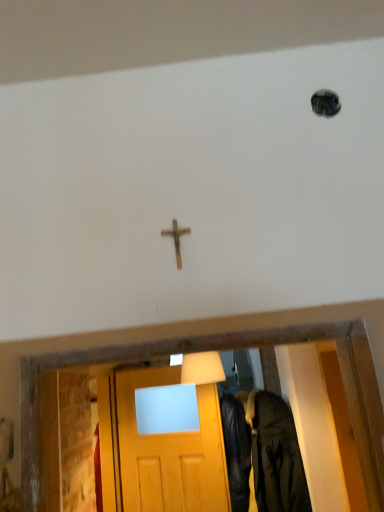
Question: Should I look upward or downward to see leather jacket at lower right?

Choices:
 (A) up
 (B) down

Answer: (B)

Question: Would you say leather jacket at lower right contains wooden cross at center?

Choices:
 (A) yes
 (B) no

Answer: (B)

Question: From a real-world perspective, is leather jacket at lower right located beneath wooden cross at center?

Choices:
 (A) yes
 (B) no

Answer: (A)

Question: Is leather jacket at lower right not within wooden cross at center?

Choices:
 (A) yes
 (B) no

Answer: (A)

Question: Are leather jacket at lower right and wooden cross at center making contact?

Choices:
 (A) no
 (B) yes

Answer: (A)

Question: Can you confirm if leather jacket at lower right is positioned to the right of wooden cross at center?

Choices:
 (A) no
 (B) yes

Answer: (B)

Question: Does leather jacket at lower right have a greater width compared to wooden cross at center?

Choices:
 (A) yes
 (B) no

Answer: (A)

Question: Can you confirm if wooden cross at center is positioned to the right of leather jacket at lower right?

Choices:
 (A) no
 (B) yes

Answer: (A)

Question: Can you confirm if wooden cross at center is bigger than leather jacket at lower right?

Choices:
 (A) no
 (B) yes

Answer: (A)

Question: From the image's perspective, would you say wooden cross at center is shown under leather jacket at lower right?

Choices:
 (A) yes
 (B) no

Answer: (B)

Question: Can you confirm if wooden cross at center is taller than leather jacket at lower right?

Choices:
 (A) yes
 (B) no

Answer: (B)

Question: From the image's perspective, is wooden cross at center above leather jacket at lower right?

Choices:
 (A) no
 (B) yes

Answer: (B)

Question: Can you confirm if wooden cross at center is smaller than leather jacket at lower right?

Choices:
 (A) no
 (B) yes

Answer: (B)

Question: In the image, is leather jacket at lower right positioned in front of or behind wooden cross at center?

Choices:
 (A) behind
 (B) front

Answer: (A)